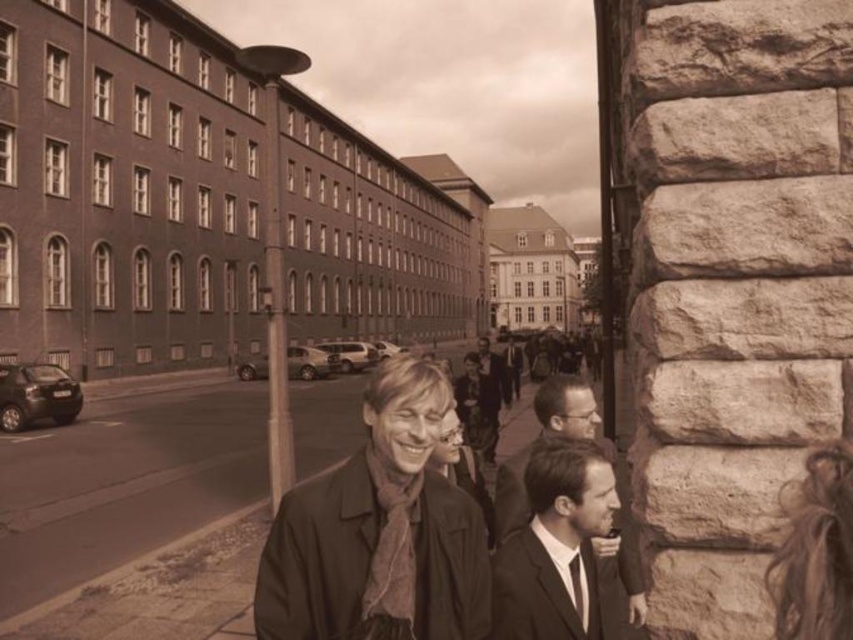
Who is positioned more to the right, dark brown leather jacket at center or smooth black suit at center?

From the viewer's perspective, smooth black suit at center appears more on the right side.

Is dark brown leather jacket at center smaller than smooth black suit at center?

Indeed, dark brown leather jacket at center has a smaller size compared to smooth black suit at center.

The height and width of the screenshot is (640, 853). Describe the element at coordinates (379, 532) in the screenshot. I see `dark brown leather jacket at center` at that location.

Image resolution: width=853 pixels, height=640 pixels. What are the coordinates of `dark brown leather jacket at center` in the screenshot? It's located at (379, 532).

Can you confirm if dark brown leather jacket at center is wider than silky black tie at lower center?

Correct, the width of dark brown leather jacket at center exceeds that of silky black tie at lower center.

Does point (426, 369) lie in front of point (578, 605)?

No, (426, 369) is behind (578, 605).

In order to click on dark brown leather jacket at center in this screenshot , I will do 379,532.

In the scene shown: Does smooth black suit at center appear over silky black tie at lower center?

Actually, smooth black suit at center is below silky black tie at lower center.

Who is higher up, smooth black suit at center or silky black tie at lower center?

silky black tie at lower center

Image resolution: width=853 pixels, height=640 pixels. What do you see at coordinates (566, 406) in the screenshot?
I see `smooth black suit at center` at bounding box center [566, 406].

I want to click on smooth black suit at center, so click(x=566, y=406).